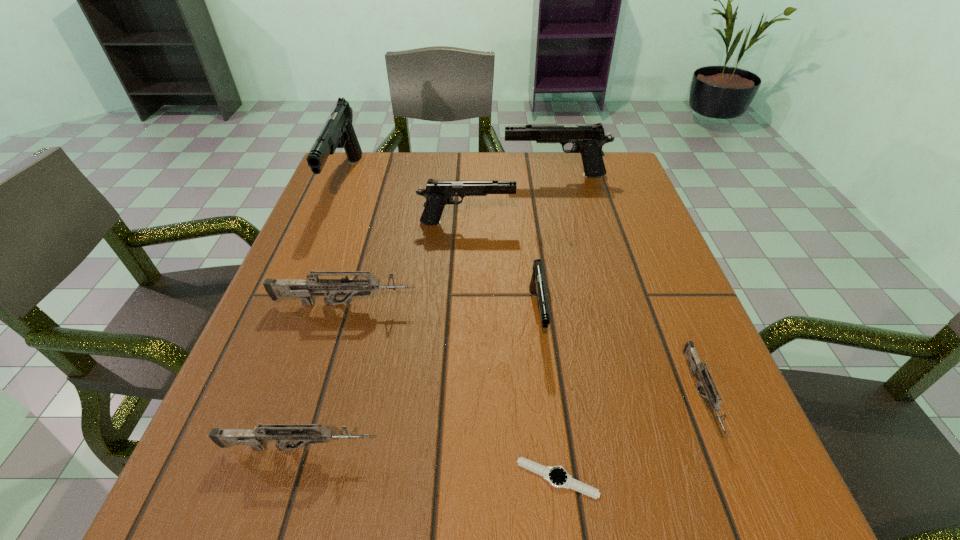
This screenshot has height=540, width=960. Find the location of `free space that is in between the sixth tallest gun and the smallest black gun`. free space that is in between the sixth tallest gun and the smallest black gun is located at coordinates (418, 381).

At what (x,y) coordinates should I click in order to perform the action: click on free space between the sixth shortest gun and the nearest black gun. Please return your answer as a coordinate pair (x, y). This screenshot has height=540, width=960. Looking at the image, I should click on (546, 245).

The width and height of the screenshot is (960, 540). Identify the location of vacant space that's between the fifth shortest gun and the sixth shortest gun. (511, 199).

Image resolution: width=960 pixels, height=540 pixels. Find the location of `the fourth closest object relative to the second smallest grey gun`. the fourth closest object relative to the second smallest grey gun is located at coordinates (714, 401).

The image size is (960, 540). Find the location of `object that is the fifth closest to the farthest grey gun`. object that is the fifth closest to the farthest grey gun is located at coordinates (557, 476).

Choose which gun is the third nearest neighbor to the second biggest grey gun. Please provide its 2D coordinates. Your answer should be formatted as a tuple, i.e. [(x, y)], where the tuple contains the x and y coordinates of a point satisfying the conditions above.

[(714, 401)]

Select which gun is the fifth closest to the seventh shortest object. Please provide its 2D coordinates. Your answer should be formatted as a tuple, i.e. [(x, y)], where the tuple contains the x and y coordinates of a point satisfying the conditions above.

[(714, 401)]

Locate which black gun is the fourth closest to the second shortest gun. Please provide its 2D coordinates. Your answer should be formatted as a tuple, i.e. [(x, y)], where the tuple contains the x and y coordinates of a point satisfying the conditions above.

[(588, 140)]

Select which black gun appears as the closest to the rightmost gun. Please provide its 2D coordinates. Your answer should be formatted as a tuple, i.e. [(x, y)], where the tuple contains the x and y coordinates of a point satisfying the conditions above.

[(537, 285)]

Locate an element on the screen. The width and height of the screenshot is (960, 540). the closest grey gun to the seventh shortest object is located at coordinates (303, 288).